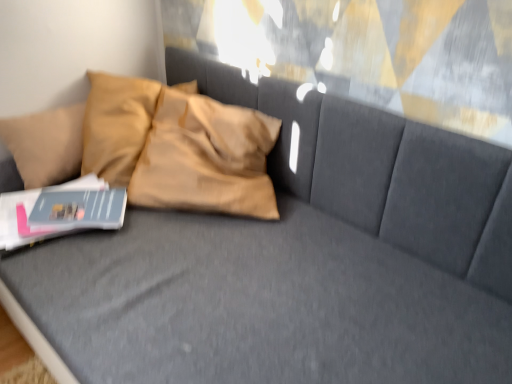
The image size is (512, 384). I want to click on free point above matte gray magazine at lower left (from a real-world perspective), so (75, 200).